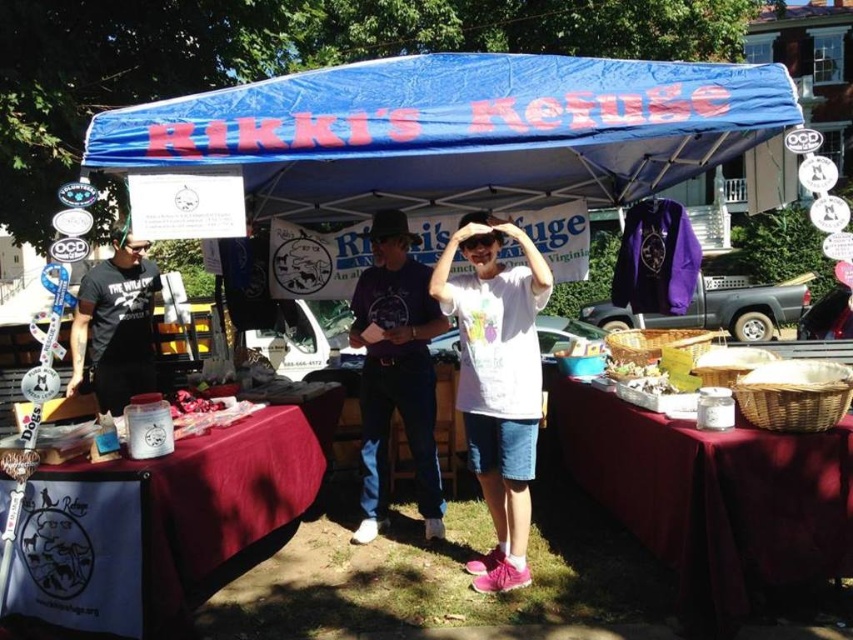
Question: Can you confirm if blue fabric canopy at upper center is wider than white cotton t-shirt at center?

Choices:
 (A) no
 (B) yes

Answer: (B)

Question: Which of the following is the closest to the observer?

Choices:
 (A) black matte t-shirt at left
 (B) woven baskets at lower right

Answer: (B)

Question: Can you confirm if denim jeans at center is positioned below black matte t-shirt at left?

Choices:
 (A) yes
 (B) no

Answer: (A)

Question: Which object appears farthest from the camera in this image?

Choices:
 (A) woven baskets at lower right
 (B) black matte t-shirt at left
 (C) white cotton t-shirt at center
 (D) denim jeans at center

Answer: (D)

Question: Is woven baskets at lower right smaller than white cotton t-shirt at center?

Choices:
 (A) no
 (B) yes

Answer: (A)

Question: Which object is positioned closest to the black matte t-shirt at left?

Choices:
 (A) woven baskets at lower right
 (B) denim jeans at center
 (C) white cotton t-shirt at center

Answer: (B)